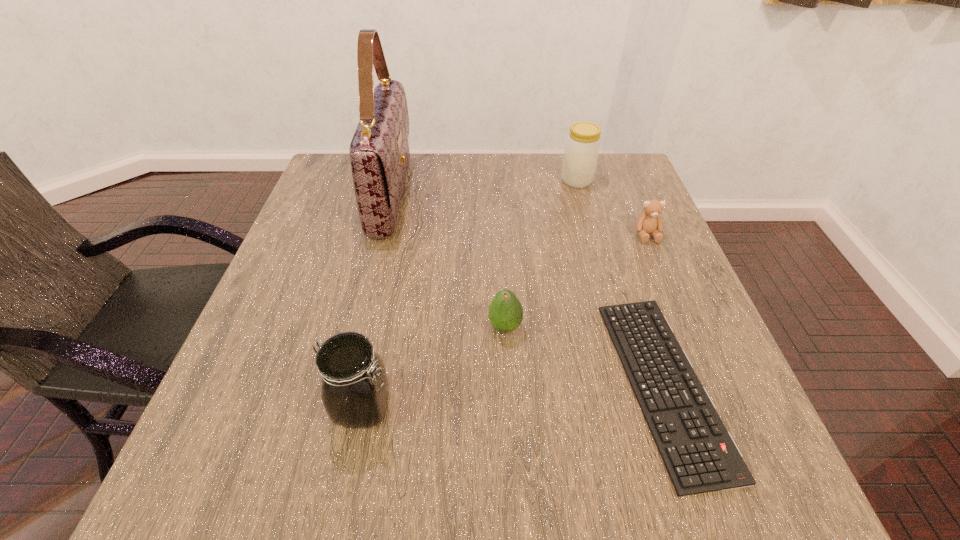
Identify the location of object at the far right corner. The width and height of the screenshot is (960, 540). (582, 147).

At what (x,y) coordinates should I click in order to perform the action: click on object that is at the near right corner. Please return your answer as a coordinate pair (x, y). The height and width of the screenshot is (540, 960). Looking at the image, I should click on (700, 455).

Locate an element on the screen. The height and width of the screenshot is (540, 960). vacant position at the far edge of the desktop is located at coordinates (455, 166).

Where is `vacant space at the near edge of the desktop`? This screenshot has width=960, height=540. vacant space at the near edge of the desktop is located at coordinates (329, 470).

In the image, there is a desktop. Where is `vacant area at the left edge`? vacant area at the left edge is located at coordinates (325, 228).

In the image, there is a desktop. At what (x,y) coordinates should I click in order to perform the action: click on vacant space at the right edge. Please return your answer as a coordinate pair (x, y). Looking at the image, I should click on (665, 262).

In order to click on free space at the far left corner in this screenshot , I will do `click(329, 175)`.

I want to click on vacant space at the far right corner, so click(602, 195).

I want to click on free space between the farther jar and the teddy bear, so click(612, 207).

Identify the location of free spot between the tallest object and the teddy bear. The height and width of the screenshot is (540, 960). (519, 215).